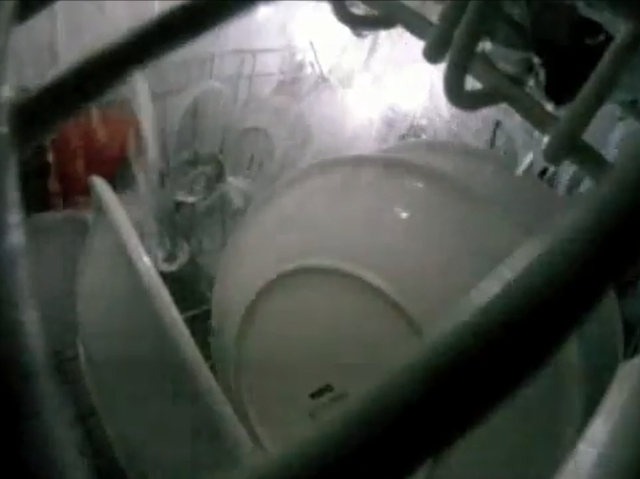
Image resolution: width=640 pixels, height=479 pixels. I want to click on red colored dish, so click(104, 152).